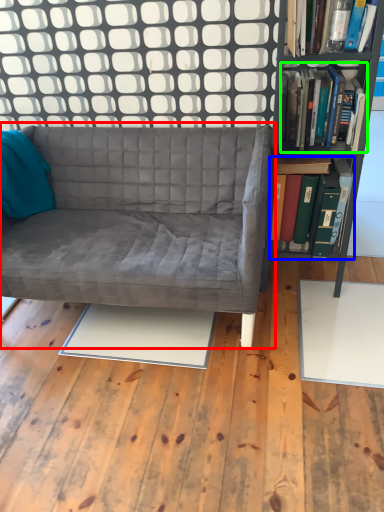
Question: Which object is positioned farthest from studio couch (highlighted by a red box)? Select from book (highlighted by a blue box) and book (highlighted by a green box).

Choices:
 (A) book
 (B) book

Answer: (A)